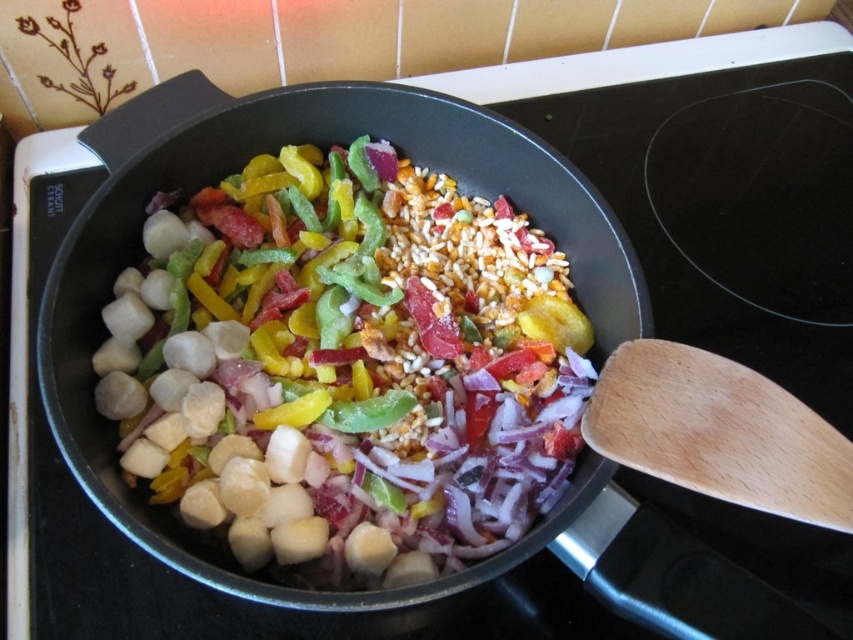
You are a chef standing in front of the stove. You need to place a new pot on the stovetop. Where exactly should you put it to avoid covering the shiny metallic scallops at center?

You should place the new pot on the stovetop away from the coordinates point at (346,365) where the shiny metallic scallops at center are located to avoid covering them.

You are a chef standing in front of the stove and need to reach both the point at coordinates point (456, 278) and point (666, 413). Which point should you approach first to reach the one closer to you?

Point (666, 413) is closer to you than point (456, 278), so you should approach point (666, 413) first.